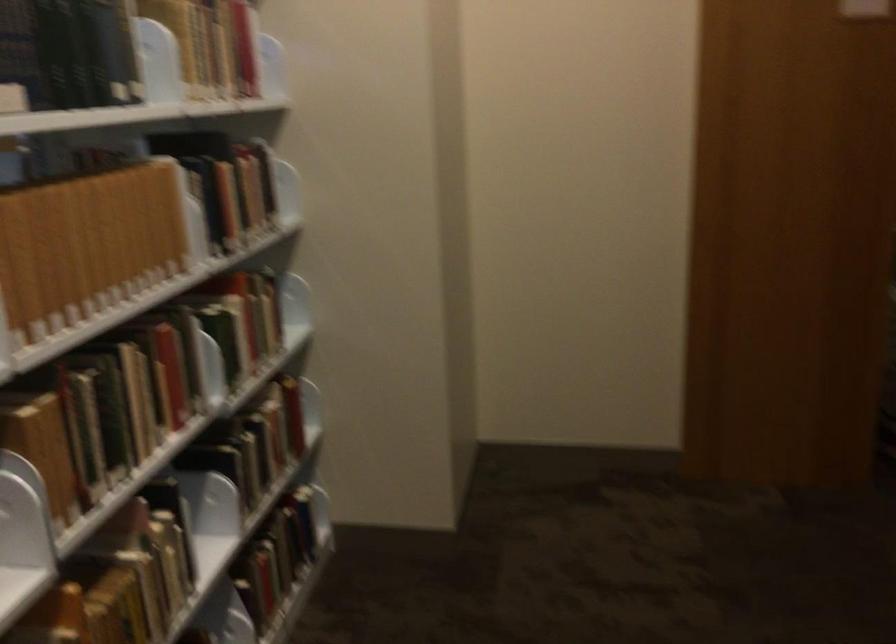
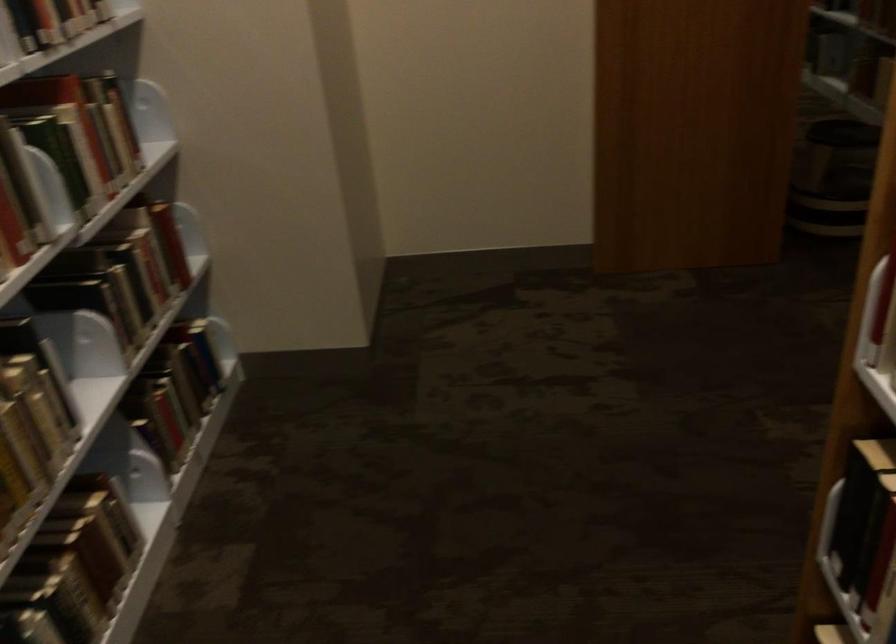
Question: The first image is from the beginning of the video and the second image is from the end. How did the camera likely rotate when shooting the video?

Choices:
 (A) Left
 (B) Right
 (C) Up
 (D) Down

Answer: (D)